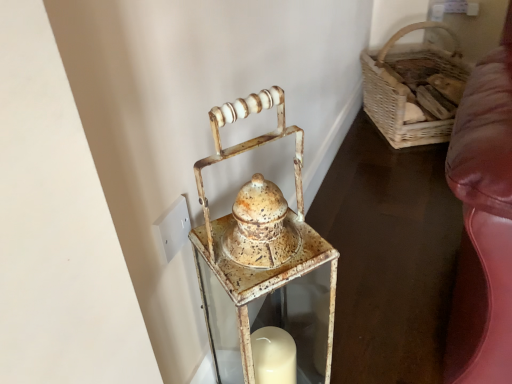
I want to click on woven wood basket at right, so click(x=396, y=111).

In order to face woven wood basket at right, should I rotate leftwards or rightwards?

Rotate right and turn 21.306 degrees.

Describe the element at coordinates (396, 111) in the screenshot. I see `woven wood basket at right` at that location.

You are a GUI agent. You are given a task and a screenshot of the screen. Output one action in this format:
    pyautogui.click(x=<x>, y=<y>)
    Task: Click on the rusty metal lantern at center
    This screenshot has width=512, height=384.
    Given the screenshot: What is the action you would take?
    pyautogui.click(x=260, y=258)

What do you see at coordinates (260, 258) in the screenshot? I see `rusty metal lantern at center` at bounding box center [260, 258].

The height and width of the screenshot is (384, 512). Find the location of `woven wood basket at right`. woven wood basket at right is located at coordinates (396, 111).

Considering the positions of objects rusty metal lantern at center and woven wood basket at right in the image provided, who is more to the right, rusty metal lantern at center or woven wood basket at right?

woven wood basket at right.

Considering their positions, is rusty metal lantern at center located in front of or behind woven wood basket at right?

Visually, rusty metal lantern at center is located in front of woven wood basket at right.

Considering the points (263, 302) and (380, 71), which point is behind, point (263, 302) or point (380, 71)?

The point (380, 71) is farther.

From the image's perspective, which one is positioned lower, rusty metal lantern at center or woven wood basket at right?

rusty metal lantern at center.

From a real-world perspective, is rusty metal lantern at center located higher than woven wood basket at right?

Yes, from a real-world perspective, rusty metal lantern at center is over woven wood basket at right

Considering the sizes of rusty metal lantern at center and woven wood basket at right in the image, is rusty metal lantern at center wider or thinner than woven wood basket at right?

rusty metal lantern at center is thinner than woven wood basket at right.

In the scene shown: Does rusty metal lantern at center have a greater height compared to woven wood basket at right?

Yes.

Can you confirm if rusty metal lantern at center is bigger than woven wood basket at right?

No.

Is rusty metal lantern at center not inside woven wood basket at right?

rusty metal lantern at center lies outside woven wood basket at right's area.

Are rusty metal lantern at center and woven wood basket at right located far from each other?

Yes, rusty metal lantern at center is far from woven wood basket at right.

Is rusty metal lantern at center oriented towards woven wood basket at right?

No, rusty metal lantern at center is not turned towards woven wood basket at right.

How many degrees apart are the facing directions of rusty metal lantern at center and woven wood basket at right?

The angular difference between rusty metal lantern at center and woven wood basket at right is 20.1 degrees.

This screenshot has height=384, width=512. I want to click on lantern lying in front of the woven wood basket at right, so click(x=260, y=258).

Based on the photo, considering the positions of objects woven wood basket at right and rusty metal lantern at center in the image provided, who is more to the left, woven wood basket at right or rusty metal lantern at center?

rusty metal lantern at center is more to the left.

Considering their positions, is woven wood basket at right located in front of or behind rusty metal lantern at center?

In the image, woven wood basket at right appears behind rusty metal lantern at center.

Does point (387, 47) come behind point (261, 326)?

Yes, point (387, 47) is behind point (261, 326).

From the image's perspective, is woven wood basket at right below rusty metal lantern at center?

No, from the image's perspective, woven wood basket at right is not below rusty metal lantern at center.

From the picture: From a real-world perspective, who is located higher, woven wood basket at right or rusty metal lantern at center?

rusty metal lantern at center is physically above.

In terms of width, does woven wood basket at right look wider or thinner when compared to rusty metal lantern at center?

woven wood basket at right is wider than rusty metal lantern at center.

In terms of height, does woven wood basket at right look taller or shorter compared to rusty metal lantern at center?

woven wood basket at right is shorter than rusty metal lantern at center.

Is woven wood basket at right bigger than rusty metal lantern at center?

Indeed, woven wood basket at right has a larger size compared to rusty metal lantern at center.

Is woven wood basket at right not within rusty metal lantern at center?

Yes, woven wood basket at right is located beyond the bounds of rusty metal lantern at center.

Would you consider woven wood basket at right to be distant from rusty metal lantern at center?

Yes.

Does woven wood basket at right turn towards rusty metal lantern at center?

No, woven wood basket at right does not turn towards rusty metal lantern at center.

Measure the distance between woven wood basket at right and rusty metal lantern at center.

woven wood basket at right is 1.16 meters away from rusty metal lantern at center.

Identify the location of lantern that appears on the left of woven wood basket at right. The image size is (512, 384). (260, 258).

Where is `lantern that appears above the woven wood basket at right (from a real-world perspective)`? This screenshot has height=384, width=512. lantern that appears above the woven wood basket at right (from a real-world perspective) is located at coordinates (260, 258).

Where is `lantern that appears in front of the woven wood basket at right`? lantern that appears in front of the woven wood basket at right is located at coordinates (260, 258).